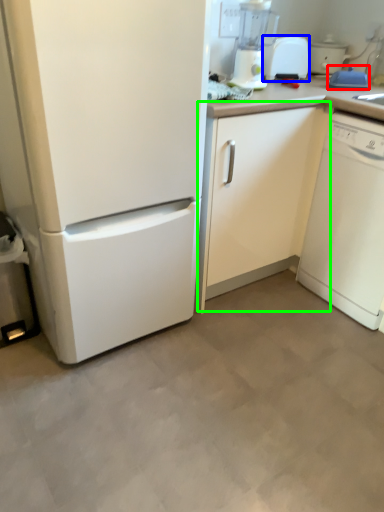
Question: Estimate the real-world distances between objects in this image. Which object is closer to appliance (highlighted by a red box), toaster (highlighted by a blue box) or cabinetry (highlighted by a green box)?

Choices:
 (A) toaster
 (B) cabinetry

Answer: (A)